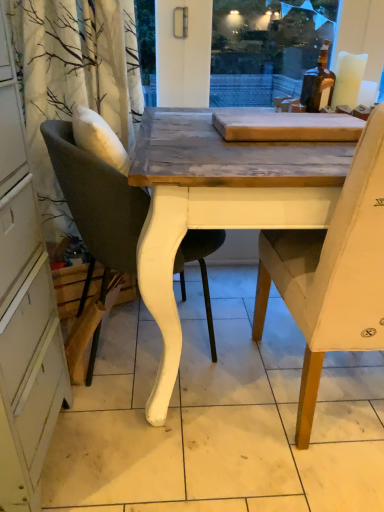
This screenshot has height=512, width=384. I want to click on free space underneath light beige fabric chair at right, which appears as the 2th chair when viewed from the left (from a real-world perspective), so click(324, 396).